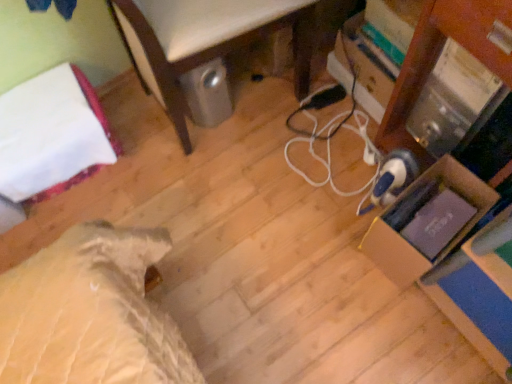
Question: Should I look upward or downward to see white cord at center?

Choices:
 (A) down
 (B) up

Answer: (B)

Question: Does white fabric bed at left appear on the left side of white cord at center?

Choices:
 (A) yes
 (B) no

Answer: (A)

Question: Can white cord at center be found inside white fabric bed at left?

Choices:
 (A) no
 (B) yes

Answer: (A)

Question: From a real-world perspective, is white fabric bed at left beneath white cord at center?

Choices:
 (A) yes
 (B) no

Answer: (B)

Question: Can you confirm if white fabric bed at left is taller than white cord at center?

Choices:
 (A) yes
 (B) no

Answer: (A)

Question: Considering the relative sizes of white fabric bed at left and white cord at center in the image provided, is white fabric bed at left wider than white cord at center?

Choices:
 (A) no
 (B) yes

Answer: (B)

Question: Is white fabric bed at left positioned in front of white cord at center?

Choices:
 (A) no
 (B) yes

Answer: (B)

Question: From a real-world perspective, is cardboard box at right physically below white cord at center?

Choices:
 (A) yes
 (B) no

Answer: (B)

Question: Considering the relative positions of cardboard box at right and white cord at center in the image provided, is cardboard box at right to the right of white cord at center from the viewer's perspective?

Choices:
 (A) no
 (B) yes

Answer: (B)

Question: From a real-world perspective, is cardboard box at right over white cord at center?

Choices:
 (A) no
 (B) yes

Answer: (B)

Question: Is cardboard box at right closer to the viewer compared to white cord at center?

Choices:
 (A) no
 (B) yes

Answer: (B)

Question: Does cardboard box at right have a greater height compared to white cord at center?

Choices:
 (A) no
 (B) yes

Answer: (B)

Question: Is there a large distance between cardboard box at right and white cord at center?

Choices:
 (A) yes
 (B) no

Answer: (B)

Question: Would you consider white cord at center to be distant from cardboard box at right?

Choices:
 (A) yes
 (B) no

Answer: (B)